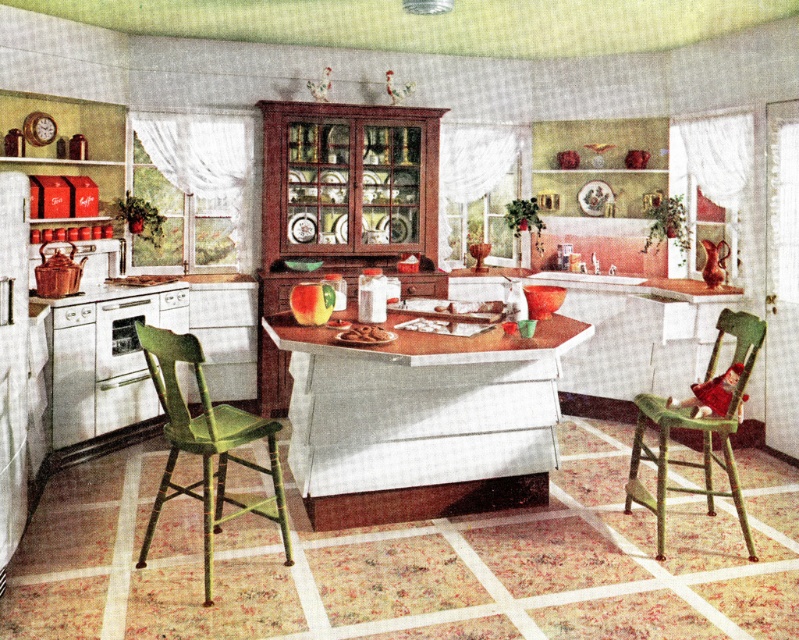
You are standing in the vintage kitchen and want to place a 1.5 meter long cake on the wooden table at center. Can you fit the cake on the table without moving any existing items?

The wooden table at center is 3.63 meters from viewer, but the distance does not indicate the table size. The question cannot be answered with the provided information.

You are standing in the vintage kitchen and want to reach both the point at coordinates point [424,349] and point [229,424]. Which point should you approach first if you want to reach the one that is closer to you?

Point [229,424] is closer to you, so you should approach it first.

Consider the image. You are planning to host a small gathering and need to seat four people comfortably. The wooden table at center and green wood chair at lower right are available. Can you seat four people using these items?

The wooden table at center is larger in size than the green wood chair at lower right. Since the table is bigger, it might accommodate seating for four people if there are enough chairs. However, only one green wood chair at lower right is mentioned, so additional chairs would be needed to seat four guests comfortably.